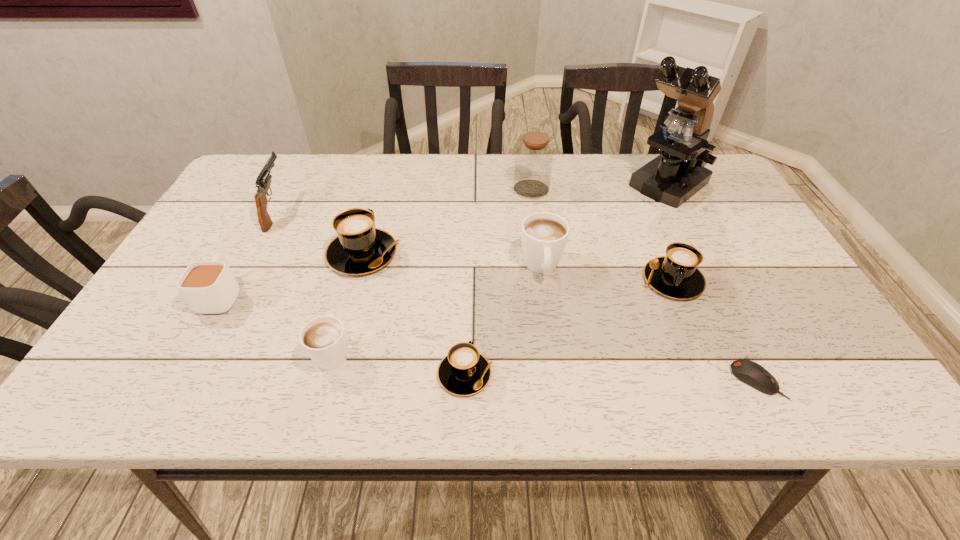
This screenshot has width=960, height=540. In order to click on vacant region located 0.230m on the left of the shortest object in this screenshot , I will do `click(615, 380)`.

The image size is (960, 540). I want to click on microscope positioned at the far edge, so click(x=679, y=172).

Locate an element on the screen. The height and width of the screenshot is (540, 960). jar present at the far edge is located at coordinates coord(534,157).

Find the location of a particular element. This screenshot has height=540, width=960. gun at the far edge is located at coordinates (263, 181).

This screenshot has width=960, height=540. Find the location of `computer mouse present at the near edge`. computer mouse present at the near edge is located at coordinates pos(749,372).

Locate an element on the screen. This screenshot has height=540, width=960. gun that is positioned at the left edge is located at coordinates (263, 181).

At what (x,y) coordinates should I click in order to perform the action: click on cup that is at the left edge. Please return your answer as a coordinate pair (x, y). The width and height of the screenshot is (960, 540). Looking at the image, I should click on (209, 287).

Where is `microscope situated at the right edge`? microscope situated at the right edge is located at coordinates (679, 172).

Locate an element on the screen. This screenshot has height=540, width=960. computer mouse situated at the right edge is located at coordinates (749, 372).

You are a GUI agent. You are given a task and a screenshot of the screen. Output one action in this format:
    pyautogui.click(x=<x>, y=<y>)
    Task: Click on the object at the far left corner
    The height and width of the screenshot is (540, 960).
    Given the screenshot: What is the action you would take?
    pyautogui.click(x=263, y=181)